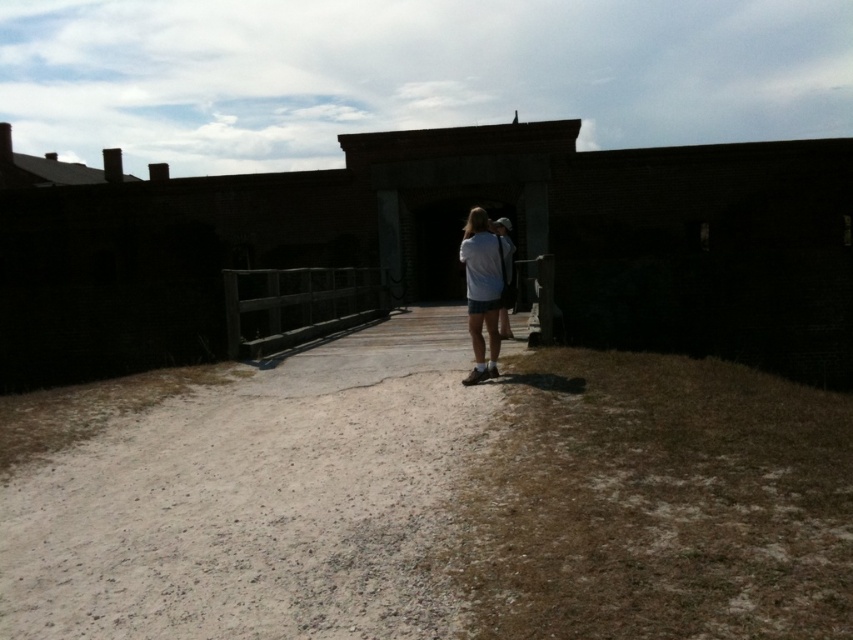
Question: Is brick wall at center to the left of white cotton shirt at center from the viewer's perspective?

Choices:
 (A) no
 (B) yes

Answer: (B)

Question: Can you confirm if brick wall at center is positioned below brown gravel path at center?

Choices:
 (A) no
 (B) yes

Answer: (A)

Question: Estimate the real-world distances between objects in this image. Which object is farther from the wooden at center?

Choices:
 (A) brown gravel path at center
 (B) brick wall at center
 (C) white cotton shirt at center
 (D) white matte shirt at center

Answer: (C)

Question: Considering the real-world distances, which object is closest to the wooden at center?

Choices:
 (A) brown gravel path at center
 (B) white matte shirt at center
 (C) brick wall at center
 (D) white cotton shirt at center

Answer: (B)

Question: Estimate the real-world distances between objects in this image. Which object is farther from the white cotton shirt at center?

Choices:
 (A) brick wall at center
 (B) white matte shirt at center
 (C) wooden at center
 (D) brown gravel path at center

Answer: (A)

Question: Is brick wall at center closer to the viewer compared to brown gravel path at center?

Choices:
 (A) no
 (B) yes

Answer: (A)